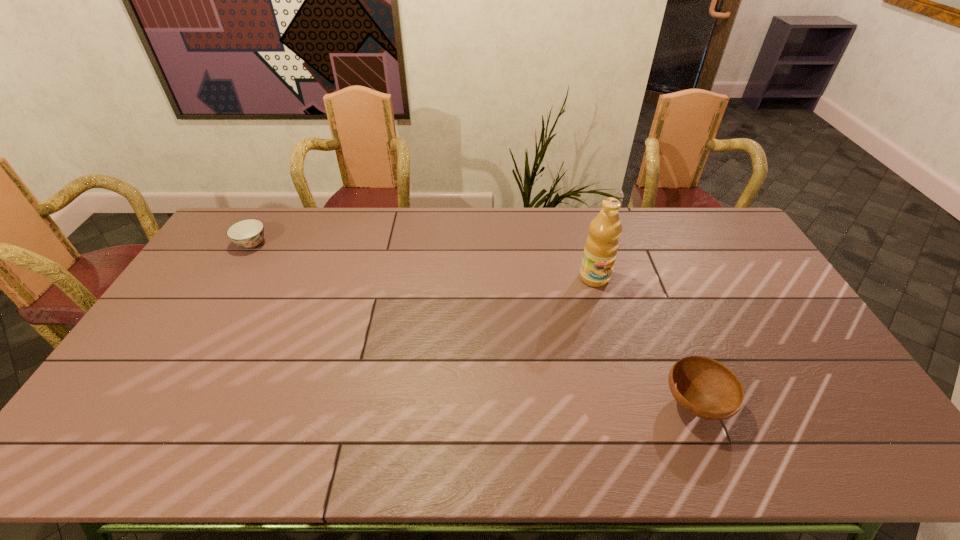
At what (x,y) coordinates should I click in order to perform the action: click on the second object from right to left. Please return your answer as a coordinate pair (x, y). This screenshot has height=540, width=960. Looking at the image, I should click on (601, 246).

Where is `olive oil`? olive oil is located at coordinates (601, 246).

Locate an element on the screen. the rightmost object is located at coordinates point(704,387).

Where is `the second tallest object`? This screenshot has width=960, height=540. the second tallest object is located at coordinates (704, 387).

Locate an element on the screen. the farthest object is located at coordinates (248, 233).

Find the location of `soup bowl`. soup bowl is located at coordinates (248, 233).

The height and width of the screenshot is (540, 960). I want to click on blank space located on the label of the second object from right to left, so click(x=603, y=309).

Locate an element on the screen. The image size is (960, 540). free space located on the back of the nearest object is located at coordinates (645, 279).

You are a GUI agent. You are given a task and a screenshot of the screen. Output one action in this format:
    pyautogui.click(x=<x>, y=<y>)
    Task: Click on the vacant space situated on the right of the leftmost object
    The height and width of the screenshot is (540, 960).
    Given the screenshot: What is the action you would take?
    pyautogui.click(x=352, y=244)

The height and width of the screenshot is (540, 960). Find the location of `object that is at the far edge`. object that is at the far edge is located at coordinates (248, 233).